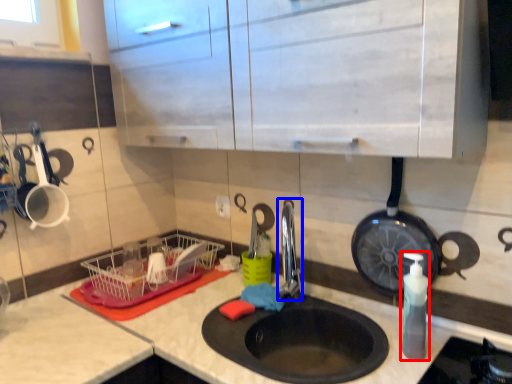
Question: Which object is further to the camera taking this photo, soap dispenser (highlighted by a red box) or faucet (highlighted by a blue box)?

Choices:
 (A) soap dispenser
 (B) faucet

Answer: (B)